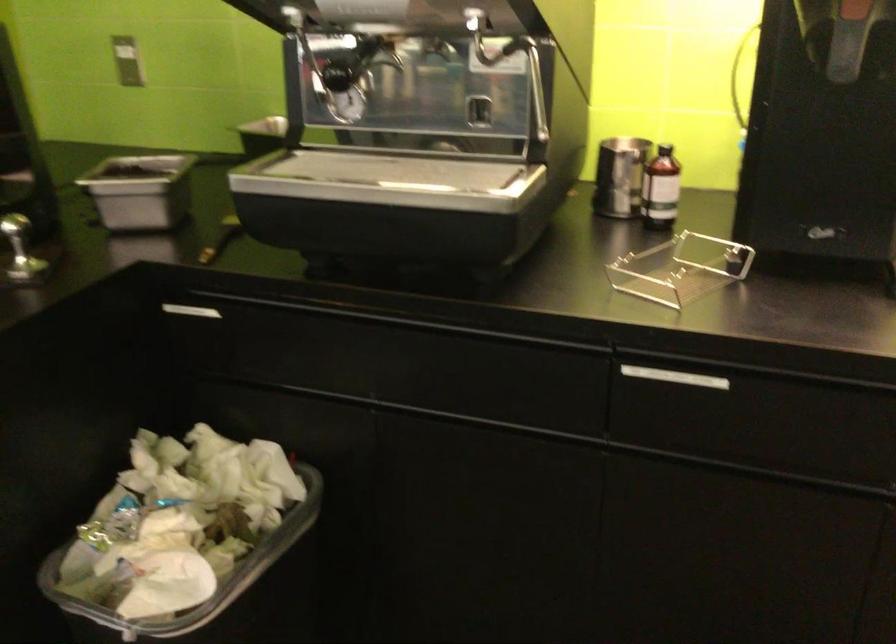
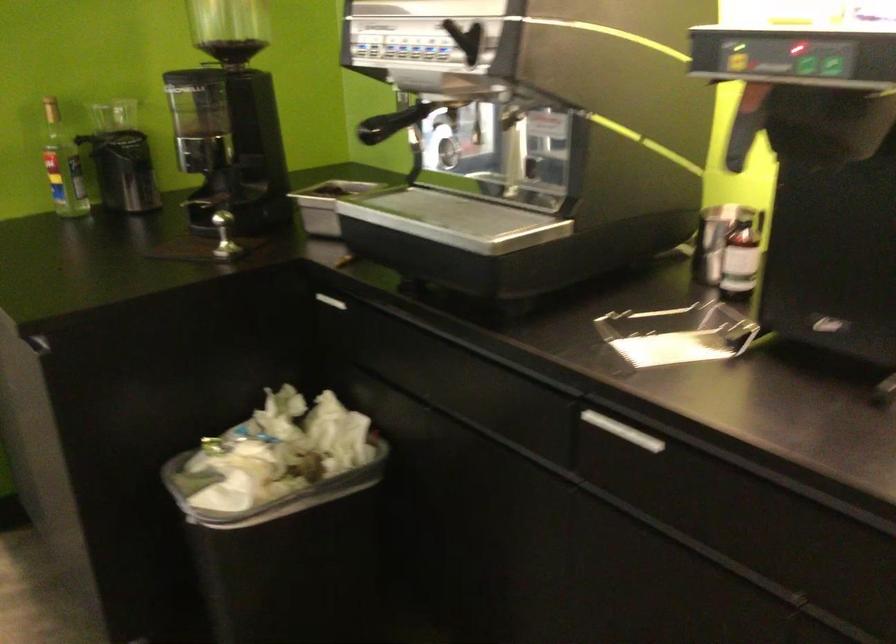
Question: The camera is either moving clockwise (left) or counter-clockwise (right) around the object. The first image is from the beginning of the video and the second image is from the end. Is the camera moving left or right when shooting the video?

Choices:
 (A) Left
 (B) Right

Answer: (B)